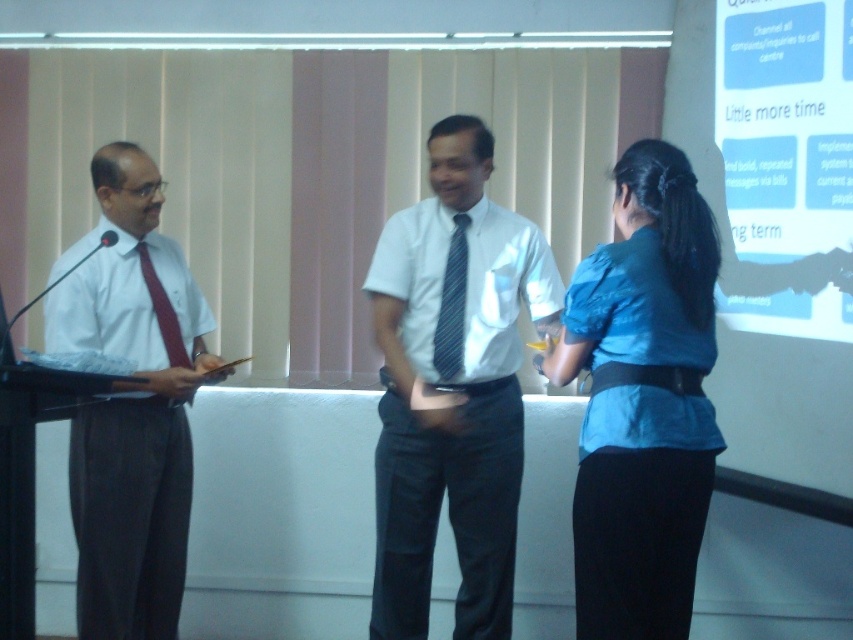
You are an attendee at the conference and want to take a photo of the white glossy projection screen at upper right. Where should you stand to ensure the screen is fully visible in your camera frame?

To ensure the white glossy projection screen at upper right is fully visible, you should position yourself in a location where the screen is within your camera frame. Since the screen is located at point coordinates [785,164], you should aim your camera towards that position.

You are a photographer positioned at the back of the room. You need to take a photo of both the matte white shirt at left and the blue striped tie at center. Can you ensure both are fully visible in the frame without any obstruction?

The matte white shirt at left is in front of the blue striped tie at center, so the matte white shirt at left may block part of the blue striped tie at center in the photo. Adjust your position to ensure both are visible without overlap.

Where is the white glossy shirt at center located in the image?

The white glossy shirt at center is located at point (451,387).